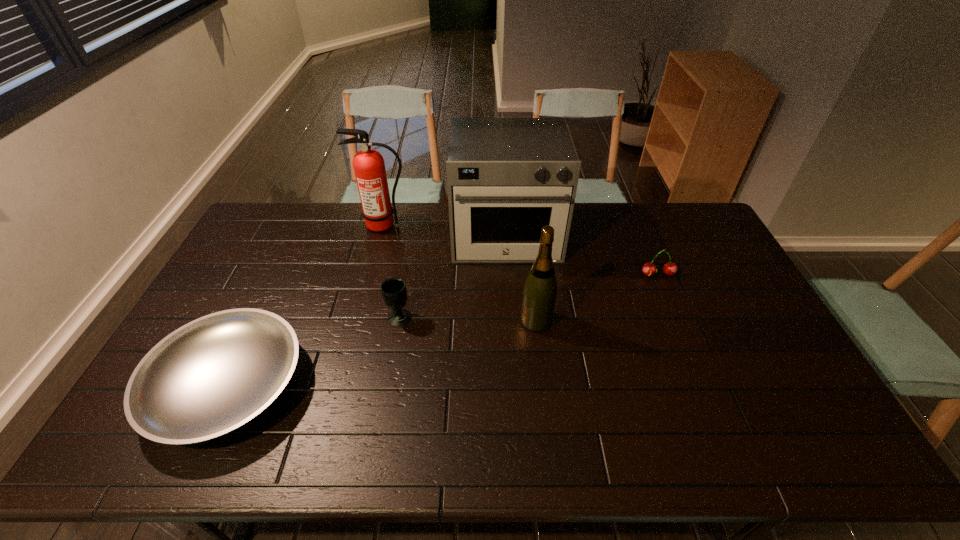
In order to click on free spot located 0.230m on the front-facing side of the wine bottle in this screenshot , I will do `click(444, 320)`.

What are the coordinates of `vacant region located 0.180m on the front-facing side of the wine bottle` in the screenshot? It's located at click(460, 320).

Image resolution: width=960 pixels, height=540 pixels. In order to click on free space located 0.220m on the front-facing side of the wine bottle in this screenshot , I will do tap(447, 320).

Identify the location of free space located on the right of the chalice. (435, 317).

Find the location of a particular element. This screenshot has height=540, width=960. vacant space located with stems pointing upwards on the second shortest object is located at coordinates (685, 341).

You are a GUI agent. You are given a task and a screenshot of the screen. Output one action in this format:
    pyautogui.click(x=<x>, y=<y>)
    Task: Click on the vacant area situated on the right of the shortest object
    
    Given the screenshot: What is the action you would take?
    pyautogui.click(x=402, y=385)

At what (x,y) coordinates should I click in order to perform the action: click on toaster oven at the far edge. Please return your answer as a coordinate pair (x, y). Image resolution: width=960 pixels, height=540 pixels. Looking at the image, I should click on (507, 178).

The image size is (960, 540). Find the location of `fire extinguisher present at the far edge`. fire extinguisher present at the far edge is located at coordinates (369, 167).

Identify the location of object that is positioned at the near edge. (213, 375).

Where is `object located in the left edge section of the desktop`? Image resolution: width=960 pixels, height=540 pixels. object located in the left edge section of the desktop is located at coordinates (213, 375).